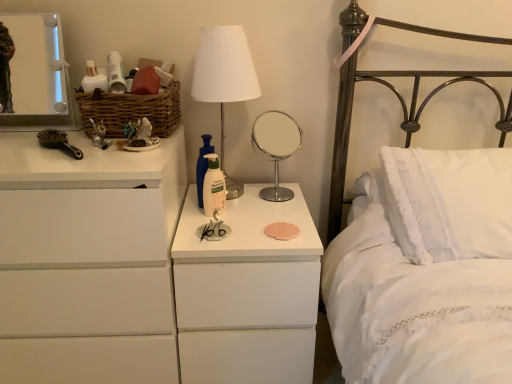
In order to face white matte lotion at center, should I rotate leftwards or rightwards?

Rotate left and turn 5.637 degrees.

This screenshot has height=384, width=512. Describe the element at coordinates (131, 111) in the screenshot. I see `woven brown basket at upper left` at that location.

Locate an element on the screen. The image size is (512, 384). matte white figurine at center, which is the 1th toy from right to left is located at coordinates (140, 135).

What is the approximate width of chrome/metallic round mirror at center, the 1th mirror positioned from the right?

6.46 inches.

Image resolution: width=512 pixels, height=384 pixels. Find the location of `white matte lotion at center`. white matte lotion at center is located at coordinates (213, 186).

Considering the positions of objects matte white figurine at center, which is the 2th toy in left-to-right order, and white matte lotion at center in the image provided, who is more to the left, matte white figurine at center, which is the 2th toy in left-to-right order, or white matte lotion at center?

matte white figurine at center, which is the 2th toy in left-to-right order, is more to the left.

How many degrees apart are the facing directions of matte white figurine at center, which is the 2th toy in left-to-right order, and white matte lotion at center?

32.6 degrees.

Is matte white figurine at center, which is the 1th toy from right to left, far away from white matte lotion at center?

matte white figurine at center, which is the 1th toy from right to left, is near white matte lotion at center, not far away.

Which is farther from the camera, (140,124) or (223,198)?

The point (223,198) is farther.

Is matte white figurine at center, which is the 1th toy from right to left, in front of or behind metallic silver toy at left, the 2th toy in the right-to-left sequence, in the image?

Visually, matte white figurine at center, which is the 1th toy from right to left, is located in front of metallic silver toy at left, the 2th toy in the right-to-left sequence.

You are a GUI agent. You are given a task and a screenshot of the screen. Output one action in this format:
    pyautogui.click(x=<x>, y=<y>)
    Task: Click on the toy lying behind the matte white figurine at center, which is the 2th toy in left-to-right order
    This screenshot has width=512, height=384.
    Given the screenshot: What is the action you would take?
    pyautogui.click(x=99, y=135)

Considering the relative sizes of matte white figurine at center, which is the 2th toy in left-to-right order, and metallic silver toy at left, the first toy in the left-to-right sequence, in the image provided, is matte white figurine at center, which is the 2th toy in left-to-right order, smaller than metallic silver toy at left, the first toy in the left-to-right sequence,?

No, matte white figurine at center, which is the 2th toy in left-to-right order, is not smaller than metallic silver toy at left, the first toy in the left-to-right sequence.

Can you confirm if white fabric lampshade at center is smaller than chrome/metallic round mirror at center, which is counted as the 2th mirror, starting from the top?

Incorrect, white fabric lampshade at center is not smaller in size than chrome/metallic round mirror at center, which is counted as the 2th mirror, starting from the top.

Considering the sizes of white fabric lampshade at center and chrome/metallic round mirror at center, which is counted as the 2th mirror, starting from the top, in the image, is white fabric lampshade at center wider or thinner than chrome/metallic round mirror at center, which is counted as the 2th mirror, starting from the top,?

In the image, white fabric lampshade at center appears to be wider than chrome/metallic round mirror at center, which is counted as the 2th mirror, starting from the top.

Is white fabric lampshade at center taller than chrome/metallic round mirror at center, acting as the second mirror starting from the left?

Correct, white fabric lampshade at center is much taller as chrome/metallic round mirror at center, acting as the second mirror starting from the left.

Is the position of white fabric lampshade at center more distant than that of chrome/metallic round mirror at center, the 1th mirror positioned from the right?

No, the depth of white fabric lampshade at center is less than that of chrome/metallic round mirror at center, the 1th mirror positioned from the right.

You are a GUI agent. You are given a task and a screenshot of the screen. Output one action in this format:
    pyautogui.click(x=<x>, y=<y>)
    Task: Click on the basket on the left of white lace pillow at right
    This screenshot has height=384, width=512.
    Given the screenshot: What is the action you would take?
    pyautogui.click(x=131, y=111)

Does woven brown basket at upper left turn towards white lace pillow at right?

No, woven brown basket at upper left is not aimed at white lace pillow at right.

Which of these two, woven brown basket at upper left or white lace pillow at right, is smaller?

With smaller size is woven brown basket at upper left.

Is woven brown basket at upper left shorter than white lace pillow at right?

Correct, woven brown basket at upper left is not as tall as white lace pillow at right.

How many degrees apart are the facing directions of chrome/metallic round mirror at center, which is counted as the 2th mirror, starting from the top, and white matte lotion at center?

The angle between the facing direction of chrome/metallic round mirror at center, which is counted as the 2th mirror, starting from the top, and the facing direction of white matte lotion at center is 34.9 degrees.

Measure the distance from chrome/metallic round mirror at center, the 1th mirror positioned from the right, to white matte lotion at center.

A distance of 1.99 meters exists between chrome/metallic round mirror at center, the 1th mirror positioned from the right, and white matte lotion at center.

Looking at this image, is chrome/metallic round mirror at center, which is counted as the 2th mirror, starting from the top, facing towards white matte lotion at center?

No, chrome/metallic round mirror at center, which is counted as the 2th mirror, starting from the top, does not turn towards white matte lotion at center.

Who is bigger, chrome/metallic round mirror at center, the 1th mirror positioned from the bottom, or white matte lotion at center?

Bigger between the two is chrome/metallic round mirror at center, the 1th mirror positioned from the bottom.

Between white matte lotion at center and metallic rectangular mirror at upper left, which is the second mirror in right-to-left order, which one has larger width?

metallic rectangular mirror at upper left, which is the second mirror in right-to-left order, is wider.

Can you tell me how much white matte lotion at center and metallic rectangular mirror at upper left, the first mirror in the left-to-right sequence, differ in facing direction?

white matte lotion at center and metallic rectangular mirror at upper left, the first mirror in the left-to-right sequence, are facing 29.1 degrees away from each other.

Is white matte lotion at center not close to metallic rectangular mirror at upper left, which is the first mirror from top to bottom?

That's not correct — white matte lotion at center is a little close to metallic rectangular mirror at upper left, which is the first mirror from top to bottom.

Where is `bottle below the metallic rectangular mirror at upper left, the first mirror in the left-to-right sequence (from a real-world perspective)`? This screenshot has width=512, height=384. bottle below the metallic rectangular mirror at upper left, the first mirror in the left-to-right sequence (from a real-world perspective) is located at coordinates (203, 166).

In the image, is woven brown basket at upper left on the left side or the right side of white glossy nightstand at center?

Based on their positions, woven brown basket at upper left is located to the left of white glossy nightstand at center.

From a real-world perspective, between woven brown basket at upper left and white glossy nightstand at center, who is vertically lower?

In real-world perspective, white glossy nightstand at center is lower.

Is woven brown basket at upper left wider or thinner than white glossy nightstand at center?

woven brown basket at upper left is thinner than white glossy nightstand at center.

From the image's perspective, between woven brown basket at upper left and white glossy nightstand at center, which one is located above?

woven brown basket at upper left appears higher in the image.

Find the location of a particular element. toiletry that is on the right side of matte white figurine at center, which is the 1th toy from right to left is located at coordinates (213, 186).

At what (x,y) coordinates should I click in order to perform the action: click on toy above the matte white figurine at center, which is the 2th toy in left-to-right order (from the image's perspective). Please return your answer as a coordinate pair (x, y). The height and width of the screenshot is (384, 512). Looking at the image, I should click on click(99, 135).

From the image, which object appears to be farther from white glossy nightstand at center, white matte lotion at center or white fabric lampshade at center?

Based on the image, white fabric lampshade at center appears to be further to white glossy nightstand at center.

Considering their positions, is matte white figurine at center, which is the 2th toy in left-to-right order, positioned closer to white matte lotion at center than white matte chest of drawers at left?

Based on the image, matte white figurine at center, which is the 2th toy in left-to-right order, appears to be nearer to white matte lotion at center.

From the image, which object appears to be nearer to white fabric lampshade at center, metallic silver toy at left, the first toy in the left-to-right sequence, or white matte lotion at center?

white matte lotion at center lies closer to white fabric lampshade at center than the other object.

Consider the image. From the image, which object appears to be farther from white matte lotion at center, matte white figurine at center, which is the 2th toy in left-to-right order, or woven brown basket at upper left?

woven brown basket at upper left lies further to white matte lotion at center than the other object.

From the image, which object appears to be farther from black plastic brush at left, metallic silver toy at left, the 2th toy in the right-to-left sequence, or white matte chest of drawers at left?

white matte chest of drawers at left lies further to black plastic brush at left than the other object.

Consider the image. Which object lies nearer to the anchor point white glossy nightstand at center, metallic silver toy at left, the first toy in the left-to-right sequence, or metallic rectangular mirror at upper left, which is the second mirror in right-to-left order?

Based on the image, metallic silver toy at left, the first toy in the left-to-right sequence, appears to be nearer to white glossy nightstand at center.

Considering their positions, is woven brown basket at upper left positioned further to chrome/metallic round mirror at center, acting as the second mirror starting from the left, than metallic rectangular mirror at upper left, which is the second mirror in right-to-left order?

metallic rectangular mirror at upper left, which is the second mirror in right-to-left order, lies further to chrome/metallic round mirror at center, acting as the second mirror starting from the left, than the other object.

From the image, which object appears to be farther from matte white figurine at center, which is the 1th toy from right to left, white matte chest of drawers at left or black plastic brush at left?

white matte chest of drawers at left.

In order to click on bottle between metallic rectangular mirror at upper left, which is the 2th mirror in bottom-to-top order, and chrome/metallic round mirror at center, which is counted as the 2th mirror, starting from the top, in the horizontal direction in this screenshot , I will do `click(203, 166)`.

Identify the location of mirror between white fabric lampshade at center and white matte lotion at center from top to bottom. (276, 147).

The width and height of the screenshot is (512, 384). In order to click on toy between metallic rectangular mirror at upper left, the first mirror in the left-to-right sequence, and woven brown basket at upper left, in the horizontal direction in this screenshot , I will do `click(99, 135)`.

You are a GUI agent. You are given a task and a screenshot of the screen. Output one action in this format:
    pyautogui.click(x=<x>, y=<y>)
    Task: Click on the toiletry located between white matte chest of drawers at left and white glossy nightstand at center in the left-right direction
    Image resolution: width=512 pixels, height=384 pixels.
    Given the screenshot: What is the action you would take?
    pyautogui.click(x=213, y=186)